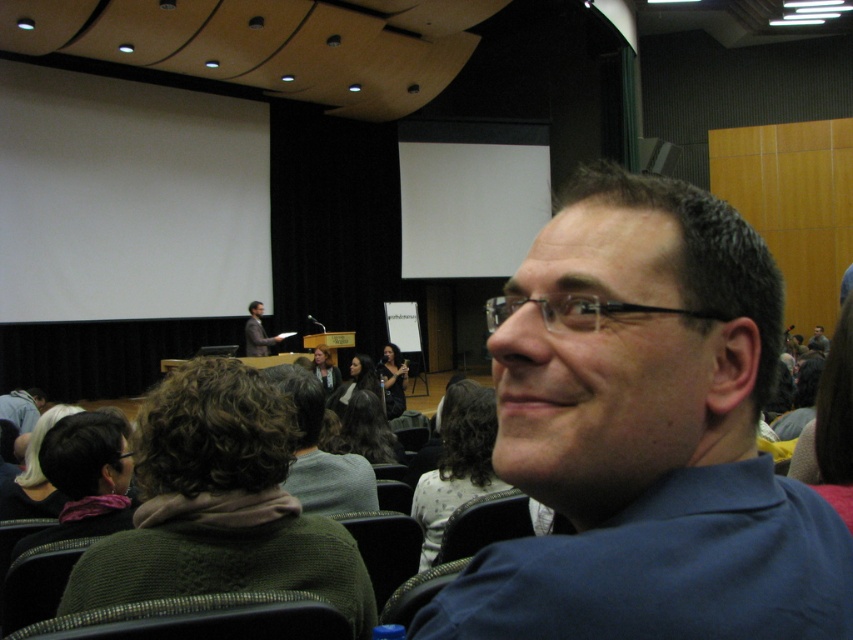
Is blue fabric shirt at center bigger than white dotted shirt at center?

Incorrect, blue fabric shirt at center is not larger than white dotted shirt at center.

Which is above, blue fabric shirt at center or white dotted shirt at center?

Positioned higher is blue fabric shirt at center.

Is point (589, 241) farther from viewer compared to point (453, 410)?

No.

Find the location of a particular element. blue fabric shirt at center is located at coordinates (645, 435).

Is blue fabric shirt at center above white fabric headband at lower left?

Correct, blue fabric shirt at center is located above white fabric headband at lower left.

Does blue fabric shirt at center have a larger size compared to white fabric headband at lower left?

Correct, blue fabric shirt at center is larger in size than white fabric headband at lower left.

Which is in front, point (529, 458) or point (38, 467)?

Point (529, 458) is more forward.

This screenshot has height=640, width=853. I want to click on blue fabric shirt at center, so click(x=645, y=435).

Does green knitted sweater at lower left have a smaller size compared to curly brown hair at center?

Actually, green knitted sweater at lower left might be larger than curly brown hair at center.

Who is more forward, (288, 573) or (335, 435)?

Positioned in front is point (288, 573).

I want to click on green knitted sweater at lower left, so click(219, 504).